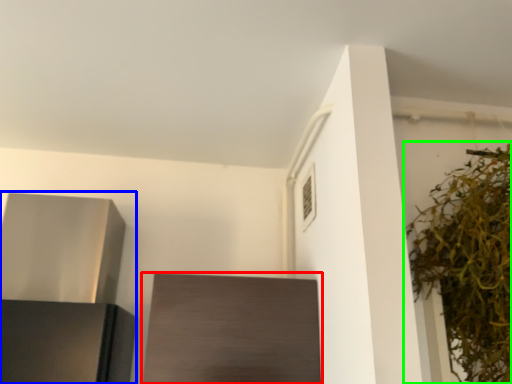
Question: Which is farther away from cabinetry (highlighted by a red box)? appliance (highlighted by a blue box) or houseplant (highlighted by a green box)?

Choices:
 (A) appliance
 (B) houseplant

Answer: (B)